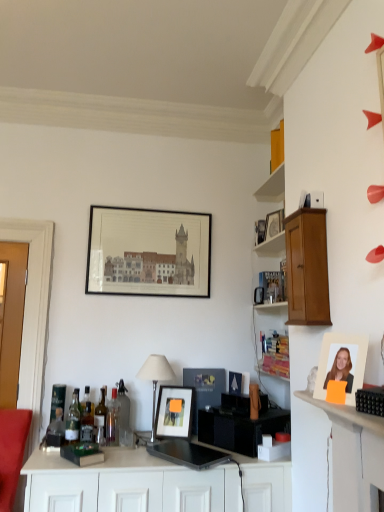
Question: From a real-world perspective, is translucent glass bottle at center, which is the 5th bottle in left-to-right order, located beneath translucent glass bottle at center, marked as the 4th bottle in a right-to-left arrangement?

Choices:
 (A) no
 (B) yes

Answer: (A)

Question: Is translucent glass bottle at center, which is the 5th bottle in left-to-right order, far from translucent glass bottle at center, the fourth bottle from the left?

Choices:
 (A) no
 (B) yes

Answer: (A)

Question: From the image's perspective, does translucent glass bottle at center, which is the 5th bottle in left-to-right order, appear higher than translucent glass bottle at center, marked as the 4th bottle in a right-to-left arrangement?

Choices:
 (A) no
 (B) yes

Answer: (A)

Question: Is translucent glass bottle at center, which is the 5th bottle in left-to-right order, taller than translucent glass bottle at center, marked as the 4th bottle in a right-to-left arrangement?

Choices:
 (A) yes
 (B) no

Answer: (A)

Question: Considering the relative positions of translucent glass bottle at center, which is the 5th bottle in left-to-right order, and translucent glass bottle at center, marked as the 4th bottle in a right-to-left arrangement, in the image provided, is translucent glass bottle at center, which is the 5th bottle in left-to-right order, to the left of translucent glass bottle at center, marked as the 4th bottle in a right-to-left arrangement, from the viewer's perspective?

Choices:
 (A) yes
 (B) no

Answer: (B)

Question: Is translucent glass bottle at center, the third bottle in the right-to-left sequence, at the right side of translucent glass bottle at center, the fourth bottle from the left?

Choices:
 (A) no
 (B) yes

Answer: (B)

Question: Is translucent glass bottle at left, marked as the second bottle in a left-to-right arrangement, at the right side of matte black picture frame at upper center, the fourth picture frame when ordered from bottom to top?

Choices:
 (A) yes
 (B) no

Answer: (B)

Question: Is translucent glass bottle at left, marked as the second bottle in a left-to-right arrangement, shorter than matte black picture frame at upper center, the first picture frame from the left?

Choices:
 (A) no
 (B) yes

Answer: (B)

Question: Would you say translucent glass bottle at left, marked as the second bottle in a left-to-right arrangement, contains matte black picture frame at upper center, positioned as the fourth picture frame in right-to-left order?

Choices:
 (A) yes
 (B) no

Answer: (B)

Question: Does translucent glass bottle at left, marked as the second bottle in a left-to-right arrangement, have a greater height compared to matte black picture frame at upper center, positioned as the 1th picture frame in top-to-bottom order?

Choices:
 (A) no
 (B) yes

Answer: (A)

Question: Does translucent glass bottle at left, positioned as the sixth bottle in right-to-left order, have a larger size compared to matte black picture frame at upper center, positioned as the fourth picture frame in right-to-left order?

Choices:
 (A) yes
 (B) no

Answer: (B)

Question: Is translucent glass bottle at left, positioned as the sixth bottle in right-to-left order, not close to matte black picture frame at upper center, positioned as the 1th picture frame in top-to-bottom order?

Choices:
 (A) no
 (B) yes

Answer: (B)

Question: Is translucent glass bottle at center, marked as the 4th bottle in a right-to-left arrangement, taller than matte black picture frame at center, the second picture frame in the front-to-back sequence?

Choices:
 (A) yes
 (B) no

Answer: (A)